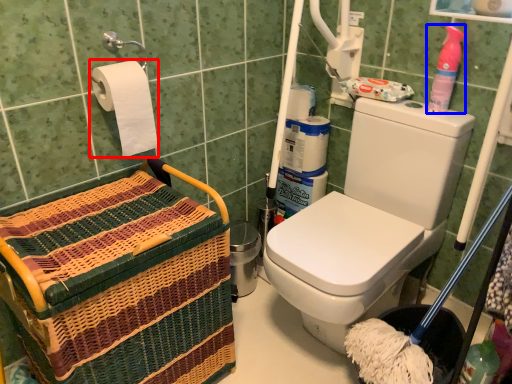
Question: Which object appears farthest to the camera in this image, toilet paper (highlighted by a red box) or cleaning product (highlighted by a blue box)?

Choices:
 (A) toilet paper
 (B) cleaning product

Answer: (B)